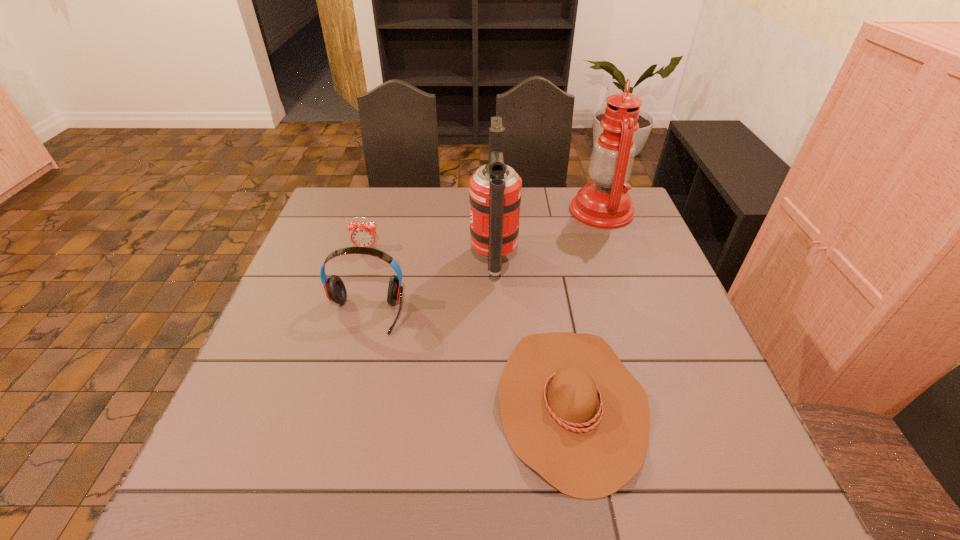
At what (x,y) coordinates should I click in order to perform the action: click on free spot located 0.320m on the face of the second shortest object. Please return your answer as a coordinate pair (x, y). Looking at the image, I should click on (338, 339).

Identify the location of free space located 0.120m on the right of the cowboy hat. This screenshot has height=540, width=960. (704, 403).

Locate an element on the screen. The width and height of the screenshot is (960, 540). object that is at the far edge is located at coordinates (605, 203).

At what (x,y) coordinates should I click in order to perform the action: click on object located in the near edge section of the desktop. Please return your answer as a coordinate pair (x, y). Looking at the image, I should click on (570, 409).

The image size is (960, 540). I want to click on headset that is at the left edge, so click(x=334, y=287).

This screenshot has width=960, height=540. Find the location of `alarm clock positioned at the left edge`. alarm clock positioned at the left edge is located at coordinates (363, 235).

The width and height of the screenshot is (960, 540). Find the location of `object present at the right edge`. object present at the right edge is located at coordinates (605, 203).

You are a GUI agent. You are given a task and a screenshot of the screen. Output one action in this format:
    pyautogui.click(x=<x>, y=<y>)
    Task: Click on the object present at the far right corner
    This screenshot has width=960, height=540.
    Given the screenshot: What is the action you would take?
    pyautogui.click(x=605, y=203)

In the image, there is a desktop. Identify the location of free space at the far edge. (550, 209).

Find the location of a particular element. The width and height of the screenshot is (960, 540). free space at the near edge is located at coordinates (495, 505).